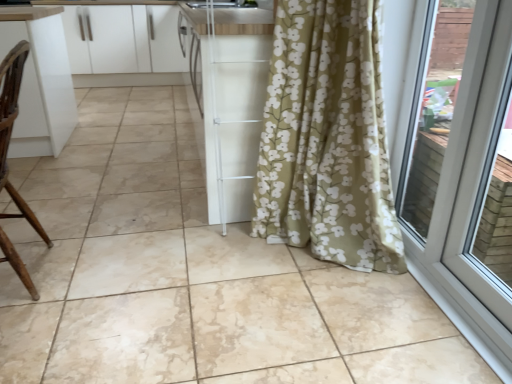
Question: Based on their positions, is brown wood chair at left located to the left or right of white plastic door at right?

Choices:
 (A) left
 (B) right

Answer: (A)

Question: Would you say brown wood chair at left is inside or outside white plastic door at right?

Choices:
 (A) outside
 (B) inside

Answer: (A)

Question: Which of these objects is positioned closest to the white glossy cabinets at upper left?

Choices:
 (A) white plastic door at right
 (B) brown wood chair at left

Answer: (B)

Question: Which object is the farthest from the white glossy cabinets at upper left?

Choices:
 (A) brown wood chair at left
 (B) white plastic door at right

Answer: (B)